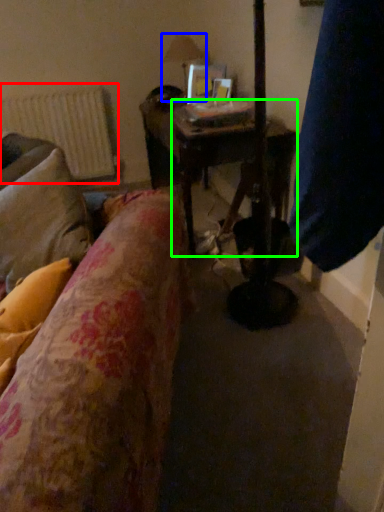
Question: Which is farther away from radiator (highlighted by a red box)? table lamp (highlighted by a blue box) or table (highlighted by a green box)?

Choices:
 (A) table lamp
 (B) table

Answer: (B)